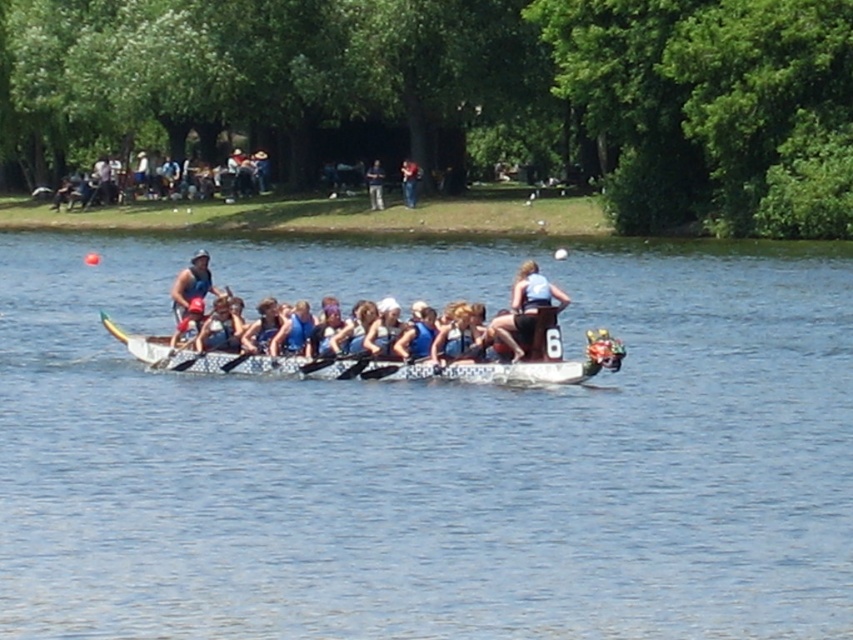
Is white glossy dragon boat at center to the right of smooth skin person at center from the viewer's perspective?

No, white glossy dragon boat at center is not to the right of smooth skin person at center.

Is white glossy dragon boat at center further to the viewer compared to smooth skin person at center?

No, white glossy dragon boat at center is closer to the viewer.

Describe the element at coordinates (500, 362) in the screenshot. Image resolution: width=853 pixels, height=640 pixels. I see `white glossy dragon boat at center` at that location.

I want to click on white glossy dragon boat at center, so click(x=500, y=362).

Describe the element at coordinates (525, 310) in the screenshot. I see `matte blue shirt at center` at that location.

Can you confirm if matte blue shirt at center is positioned to the right of matte blue tank top at center?

Correct, you'll find matte blue shirt at center to the right of matte blue tank top at center.

In order to click on matte blue shirt at center in this screenshot , I will do 525,310.

Is point (512, 314) positioned behind point (374, 204)?

No, (512, 314) is in front of (374, 204).

What do you see at coordinates (525, 310) in the screenshot? I see `matte blue shirt at center` at bounding box center [525, 310].

This screenshot has width=853, height=640. What do you see at coordinates (525, 310) in the screenshot?
I see `matte blue shirt at center` at bounding box center [525, 310].

Find the location of a particular element. matte blue shirt at center is located at coordinates (525, 310).